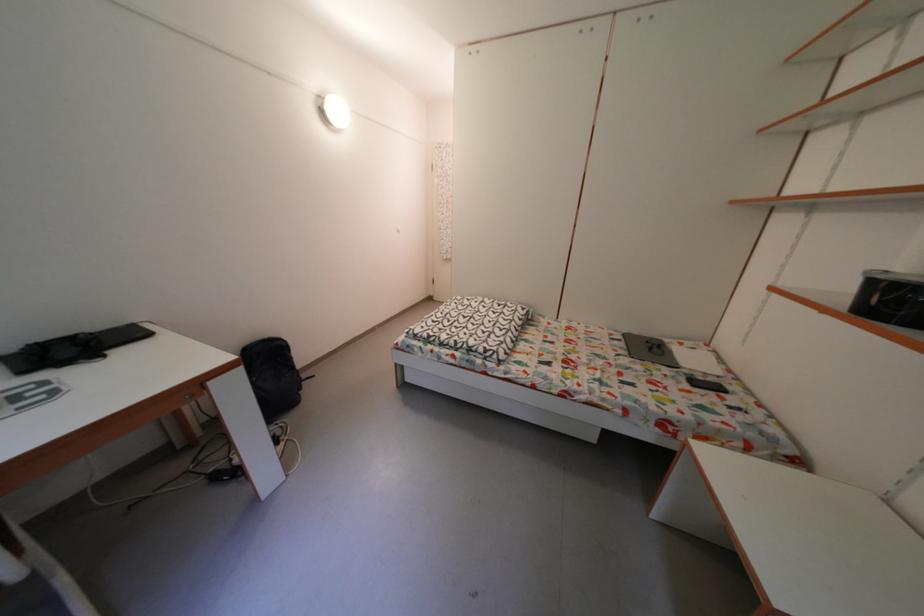
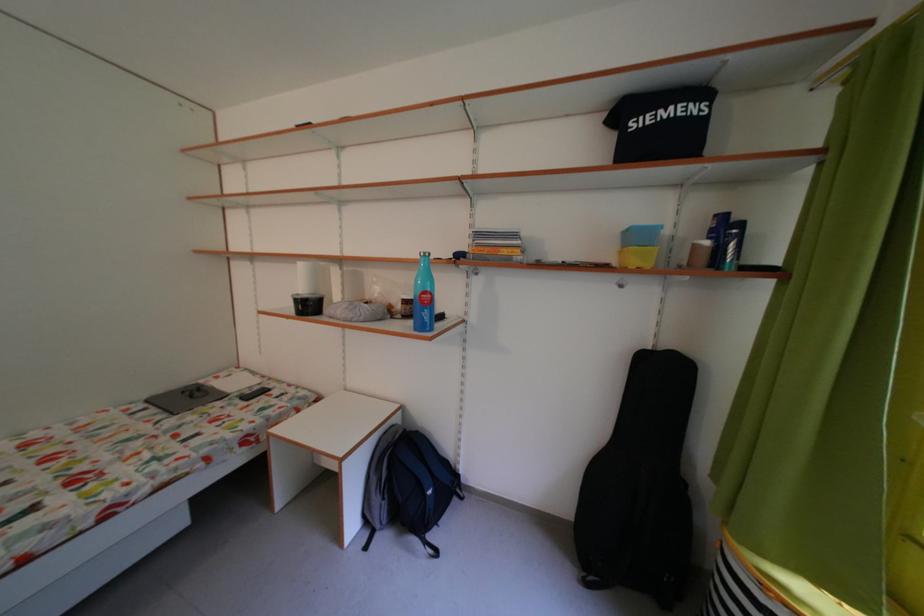
Locate, in the second image, the point that corresponds to point (634, 341) in the first image.

(156, 407)